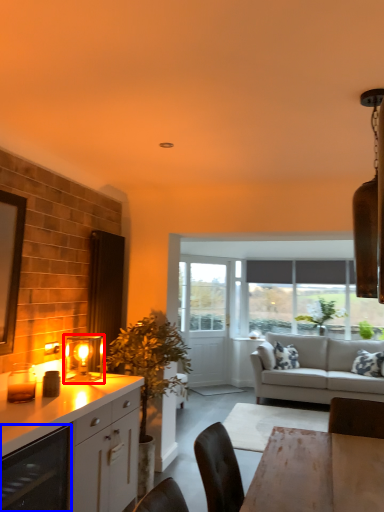
Question: Which of the following is the farthest to the observer, light fixture (highlighted by a red box) or appliance (highlighted by a blue box)?

Choices:
 (A) light fixture
 (B) appliance

Answer: (A)